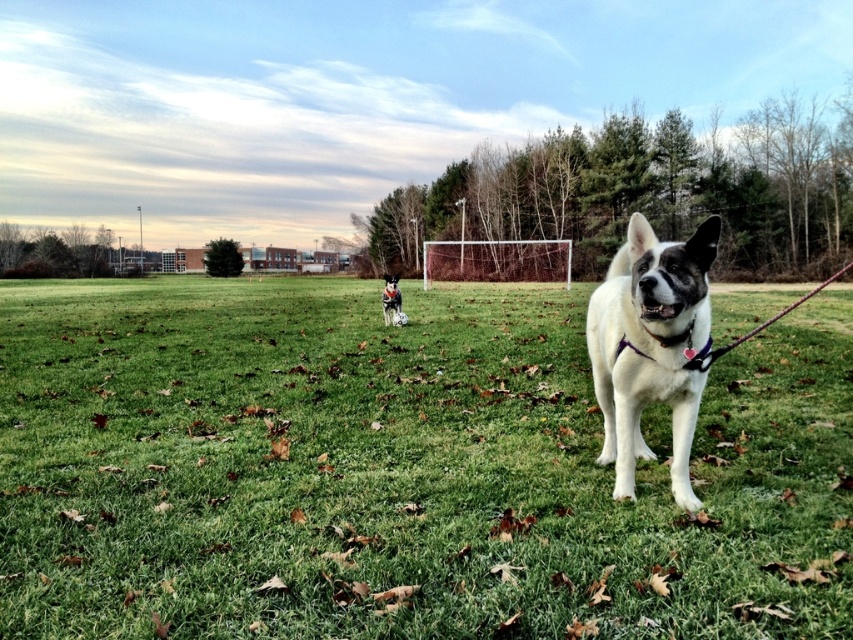
You are a photographer trying to capture the perfect shot of the black and white fur at center and the green grass at center. Which object is located to the right of the other?

The green grass at center is positioned on the right side of black and white fur at center.

You are a photographer trying to capture a photo of the white fur dog at center and the black and white fur at center. Since you want to ensure both subjects are in focus, you need to know their positions relative to each other. Which one is positioned more to the right side of the frame?

The white fur dog at center is positioned more to the right side of the frame compared to the black and white fur at center.